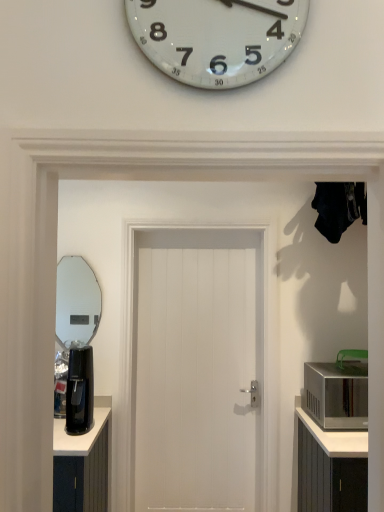
Question: Is silver metallic microwave at right thinner than black plastic coffee machine at left?

Choices:
 (A) no
 (B) yes

Answer: (A)

Question: Is silver metallic microwave at right further to camera compared to black plastic coffee machine at left?

Choices:
 (A) yes
 (B) no

Answer: (A)

Question: Is silver metallic microwave at right shorter than black plastic coffee machine at left?

Choices:
 (A) no
 (B) yes

Answer: (B)

Question: From a real-world perspective, is silver metallic microwave at right over black plastic coffee machine at left?

Choices:
 (A) yes
 (B) no

Answer: (B)

Question: Is black plastic coffee machine at left at the back of silver metallic microwave at right?

Choices:
 (A) no
 (B) yes

Answer: (A)

Question: Does silver metallic microwave at right have a larger size compared to black plastic coffee machine at left?

Choices:
 (A) yes
 (B) no

Answer: (A)

Question: Can we say black plastic coffee machine at left lies outside white wooden door at center?

Choices:
 (A) yes
 (B) no

Answer: (A)

Question: Can you confirm if black plastic coffee machine at left is taller than white wooden door at center?

Choices:
 (A) no
 (B) yes

Answer: (A)

Question: Is black plastic coffee machine at left to the left of white wooden door at center from the viewer's perspective?

Choices:
 (A) no
 (B) yes

Answer: (B)

Question: Is black plastic coffee machine at left next to white wooden door at center?

Choices:
 (A) no
 (B) yes

Answer: (A)

Question: Considering the relative positions of black plastic coffee machine at left and white wooden door at center in the image provided, is black plastic coffee machine at left in front of white wooden door at center?

Choices:
 (A) yes
 (B) no

Answer: (A)

Question: From a real-world perspective, does black plastic coffee machine at left stand above white wooden door at center?

Choices:
 (A) no
 (B) yes

Answer: (A)

Question: From the image's perspective, is black plastic coffee machine at left located beneath silver metallic microwave at right?

Choices:
 (A) yes
 (B) no

Answer: (B)